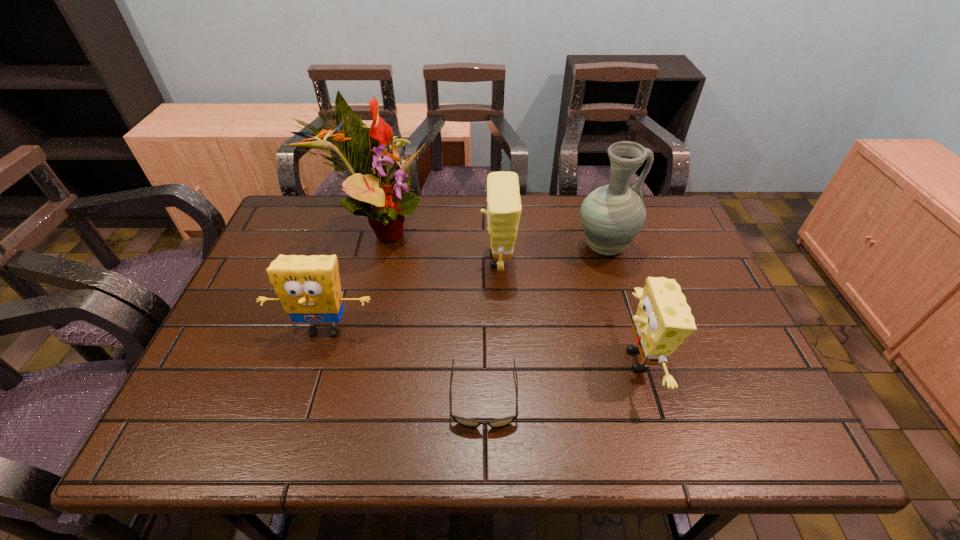
Find the location of a particular element. The height and width of the screenshot is (540, 960). free area in between the shortest object and the second tallest object is located at coordinates (544, 322).

You are a GUI agent. You are given a task and a screenshot of the screen. Output one action in this format:
    pyautogui.click(x=<x>, y=<y>)
    Task: Click on the vacant space that is in between the leftmost sponge and the farthest sponge
    The image size is (960, 540).
    Given the screenshot: What is the action you would take?
    pyautogui.click(x=411, y=295)

Identify the location of unoccupied area between the rightmost sponge and the leftmost sponge. The height and width of the screenshot is (540, 960). (481, 345).

Locate an element on the screen. This screenshot has height=540, width=960. vacant space that's between the second sponge from right to left and the bouquet is located at coordinates (437, 245).

I want to click on blank region between the shortest object and the rightmost sponge, so click(x=562, y=379).

This screenshot has width=960, height=540. Find the location of `object that is the third closest to the rightmost sponge`. object that is the third closest to the rightmost sponge is located at coordinates (504, 207).

Select which object appears as the second closest to the rightmost sponge. Please provide its 2D coordinates. Your answer should be formatted as a tuple, i.e. [(x, y)], where the tuple contains the x and y coordinates of a point satisfying the conditions above.

[(467, 422)]

Identify which sponge is the closest to the rightmost sponge. Please provide its 2D coordinates. Your answer should be formatted as a tuple, i.e. [(x, y)], where the tuple contains the x and y coordinates of a point satisfying the conditions above.

[(504, 207)]

Select which sponge is the closest to the tallest object. Please provide its 2D coordinates. Your answer should be formatted as a tuple, i.e. [(x, y)], where the tuple contains the x and y coordinates of a point satisfying the conditions above.

[(504, 207)]

Where is `vacant space that satisfies the following two spatial constraints: 1. on the handle side of the pitcher; 2. on the front-facing side of the shortest object`? vacant space that satisfies the following two spatial constraints: 1. on the handle side of the pitcher; 2. on the front-facing side of the shortest object is located at coordinates (649, 397).